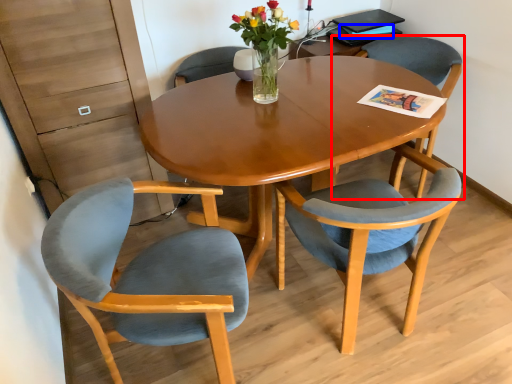
Question: Which point is further to the camera, chair (highlighted by a red box) or magazine (highlighted by a blue box)?

Choices:
 (A) chair
 (B) magazine

Answer: (B)